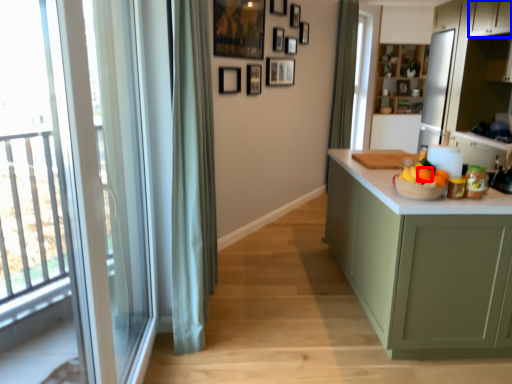
Question: Which object is further to the camera taking this photo, orange (highlighted by a red box) or cabinetry (highlighted by a blue box)?

Choices:
 (A) orange
 (B) cabinetry

Answer: (B)